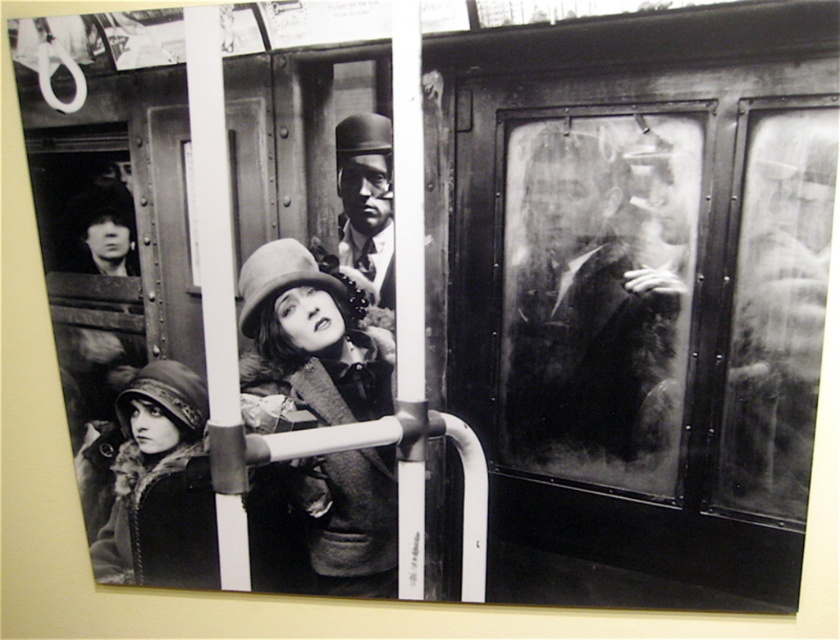
You are a photographer trying to capture a clear shot of both the smooth black coat at right and the fuzzy felt hat at center. Given their positions and sizes, can you fit both into your camera frame without cropping either of them?

The smooth black coat at right might be wider than fuzzy felt hat at center, so it depends on the camera frame size. If the frame can accommodate the width of the smooth black coat at right, then both can be included without cropping.